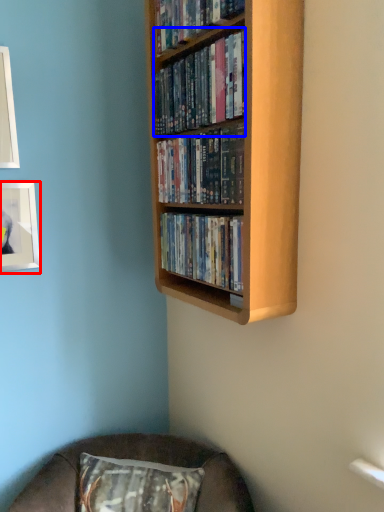
Question: Which object is closer to the camera taking this photo, picture frame (highlighted by a red box) or book (highlighted by a blue box)?

Choices:
 (A) picture frame
 (B) book

Answer: (B)